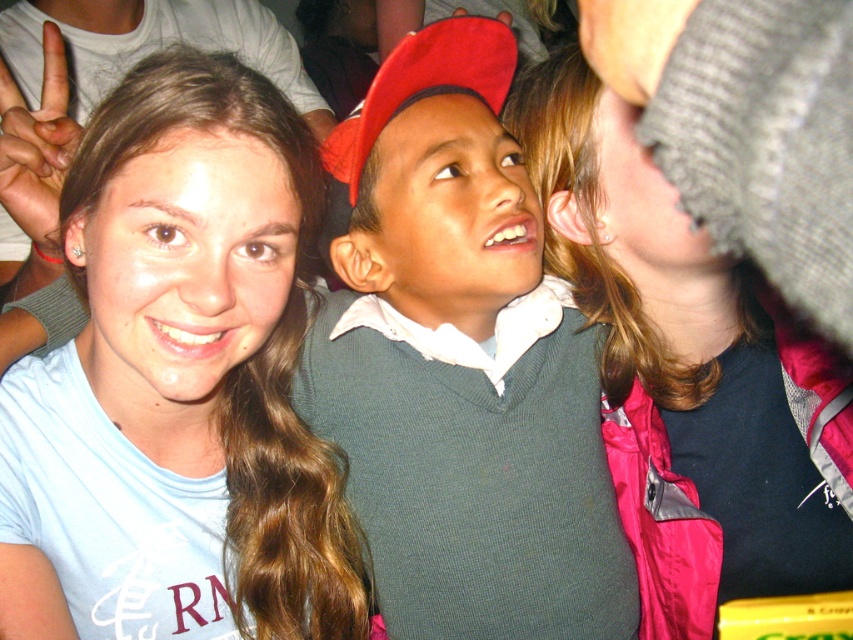
Question: Can you confirm if light blue cotton shirt at center is thinner than knitted gray hat at upper right?

Choices:
 (A) no
 (B) yes

Answer: (B)

Question: Considering the real-world distances, which object is farthest from the green knitted sweater at center?

Choices:
 (A) knitted gray hat at upper right
 (B) light blue cotton shirt at center

Answer: (B)

Question: Among these objects, which one is farthest from the camera?

Choices:
 (A) light blue cotton shirt at center
 (B) knitted gray hat at upper right
 (C) green knitted sweater at center

Answer: (B)

Question: Can you confirm if green knitted sweater at center is smaller than knitted gray hat at upper right?

Choices:
 (A) yes
 (B) no

Answer: (B)

Question: Is light blue cotton shirt at center above knitted gray hat at upper right?

Choices:
 (A) yes
 (B) no

Answer: (B)

Question: Among these points, which one is farthest from the camera?

Choices:
 (A) (505, 61)
 (B) (576, 177)

Answer: (B)